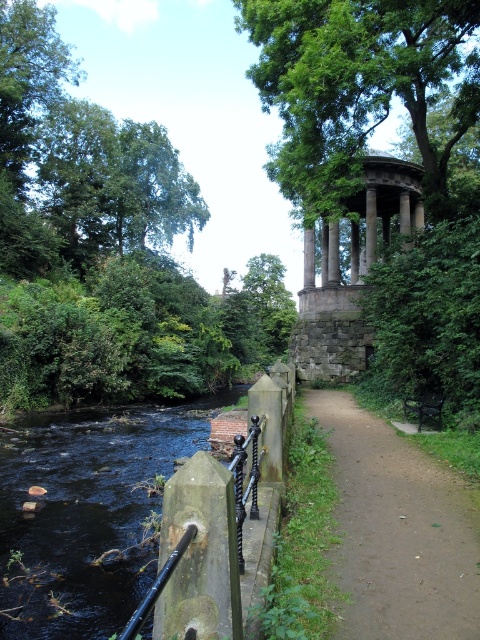
You are standing on the brown dirt path at center and want to cross to the other side of the brown stone river at lower left. Is the river directly beneath the path, making it possible to step down onto it from the path?

The brown stone river at lower left is positioned under the brown dirt path at center, so yes, the river is directly beneath the path, allowing you to step down onto it from the path.

You are standing at the camera position and want to reach the point marked as point (304, 237). If your walking speed is 1.5 meters per second, how many seconds will it take you to reach that point?

The distance of point (304, 237) from camera is 26.44 meters. At a walking speed of 1.5 meters per second, it will take approximately 17.63 seconds to reach the point.